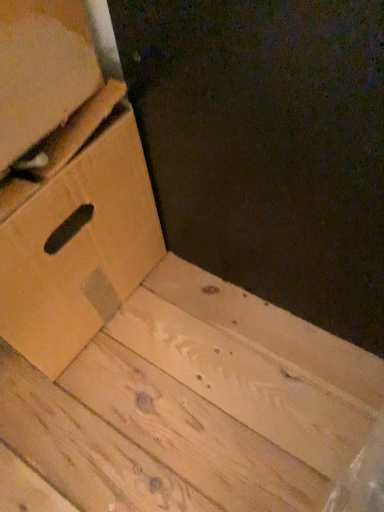
Question: From the image's perspective, is matte cardboard box at left positioned above or below brown cardboard drawer at lower left?

Choices:
 (A) above
 (B) below

Answer: (A)

Question: Would you say matte cardboard box at left is inside or outside brown cardboard drawer at lower left?

Choices:
 (A) outside
 (B) inside

Answer: (A)

Question: Is matte cardboard box at left bigger or smaller than brown cardboard drawer at lower left?

Choices:
 (A) big
 (B) small

Answer: (B)

Question: Is point (62, 312) closer or farther from the camera than point (23, 120)?

Choices:
 (A) farther
 (B) closer

Answer: (A)

Question: Is brown cardboard drawer at lower left to the left or to the right of matte cardboard box at left in the image?

Choices:
 (A) right
 (B) left

Answer: (B)

Question: From a real-world perspective, relative to matte cardboard box at left, is brown cardboard drawer at lower left vertically above or below?

Choices:
 (A) above
 (B) below

Answer: (B)

Question: From their relative heights in the image, would you say brown cardboard drawer at lower left is taller or shorter than matte cardboard box at left?

Choices:
 (A) tall
 (B) short

Answer: (A)